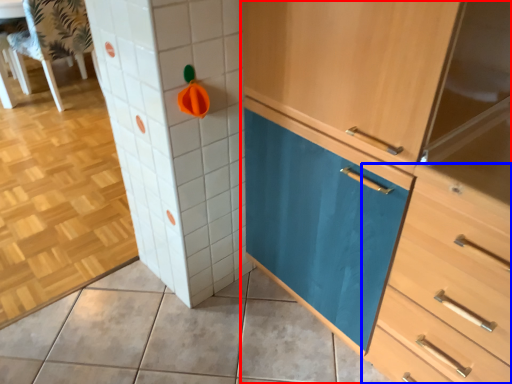
Question: Which of the following is the closest to the observer, cabinetry (highlighted by a red box) or chest of drawers (highlighted by a blue box)?

Choices:
 (A) cabinetry
 (B) chest of drawers

Answer: (B)